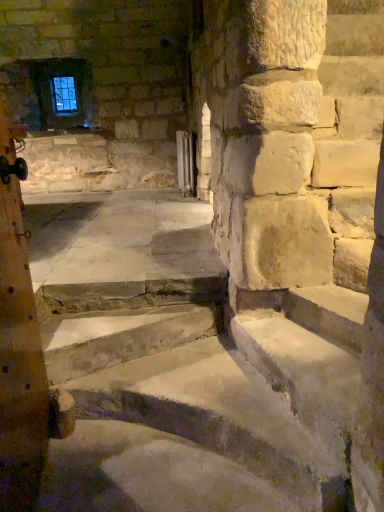
This screenshot has height=512, width=384. What are the coordinates of `blank space situated above smooth stone stairs at center (from a real-world perspective)` in the screenshot? It's located at (201, 385).